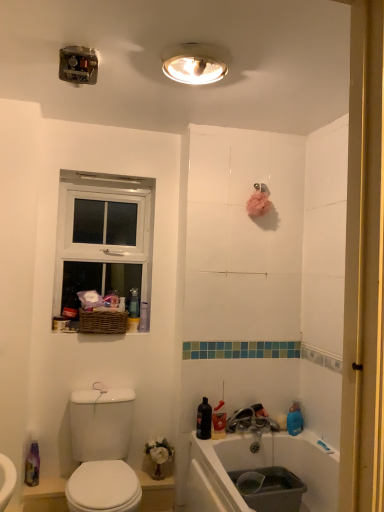
Question: From the image's perspective, is white glossy toilet at lower left above or below matte plastic container at left?

Choices:
 (A) above
 (B) below

Answer: (B)

Question: Looking at their shapes, would you say white glossy toilet at lower left is wider or thinner than matte plastic container at left?

Choices:
 (A) wide
 (B) thin

Answer: (A)

Question: Which object is positioned farthest from the white glossy toilet at lower left?

Choices:
 (A) translucent plastic spray bottle at lower left
 (B) metallic silver faucet at lower center
 (C) woven brown basket at upper left
 (D) white plastic light fixture at upper center
 (E) white wooden window at upper left

Answer: (D)

Question: Which is farther from the white wooden window at upper left?

Choices:
 (A) translucent plastic spray bottle at lower left
 (B) woven brown basket at upper left
 (C) white plastic light fixture at upper center
 (D) metallic silver faucet at lower center
 (E) white glossy toilet at lower left

Answer: (D)